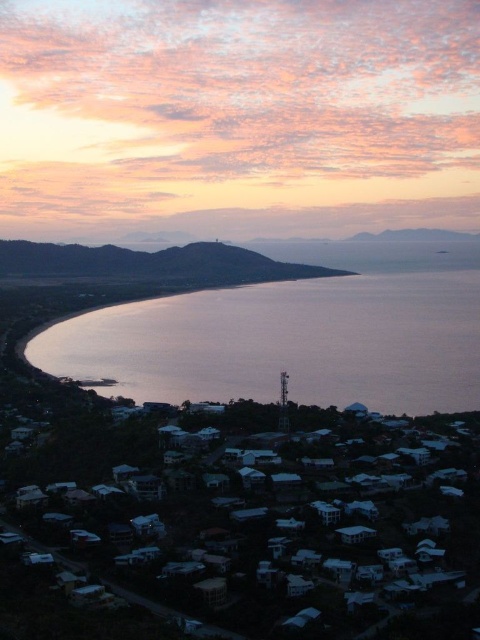
From the picture: You are standing at the top of the hill overlooking the coastal scene. You notice a point marked at coordinates (288, 342). Based on the image description, where is this point located?

The point at (288, 342) is on the silvery reflective water at center.

You are an artist trying to paint the coastal scene. You want to ensure the pink cloud at upper center and the matte brown hillside at center are proportionally accurate. Which object should you make wider in your painting?

The pink cloud at upper center should be made wider than the matte brown hillside at center since its width surpasses the hillside.